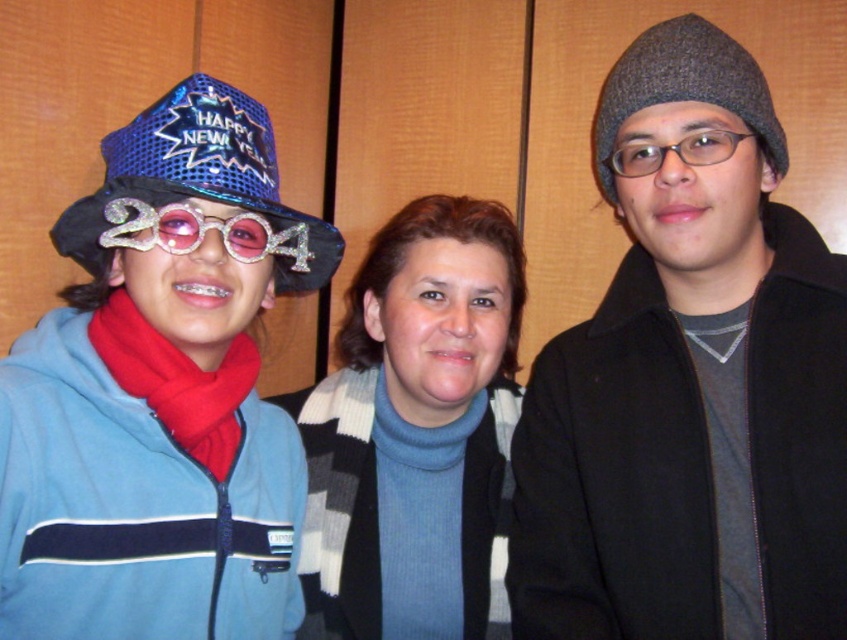
Question: Which point is closer to the camera?

Choices:
 (A) (170, 401)
 (B) (104, 196)
 (C) (483, 262)
 (D) (785, 284)

Answer: (B)

Question: Is shiny sequined hat at left below blue knit sweater at center?

Choices:
 (A) no
 (B) yes

Answer: (A)

Question: Can you confirm if blue knit sweater at center is smaller than red fleece scarf at left?

Choices:
 (A) no
 (B) yes

Answer: (A)

Question: Which point is closer to the camera?

Choices:
 (A) (336, 259)
 (B) (449, 637)
 (C) (630, 148)

Answer: (C)

Question: Can you confirm if knit woolen beanie at right is smaller than blue knit sweater at center?

Choices:
 (A) yes
 (B) no

Answer: (B)

Question: Which point is closer to the camera?

Choices:
 (A) shiny sequined hat at left
 (B) transparent plastic goggles at right

Answer: (A)